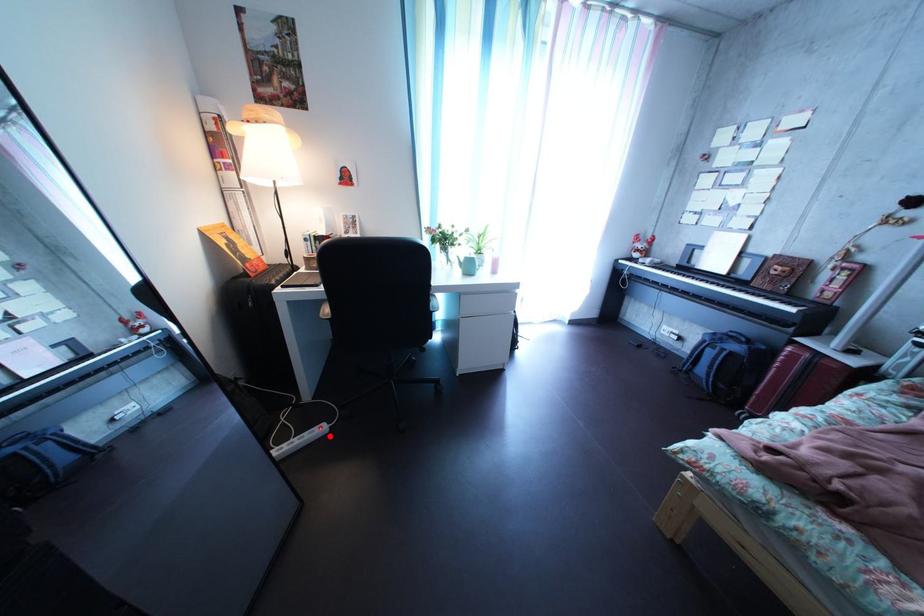
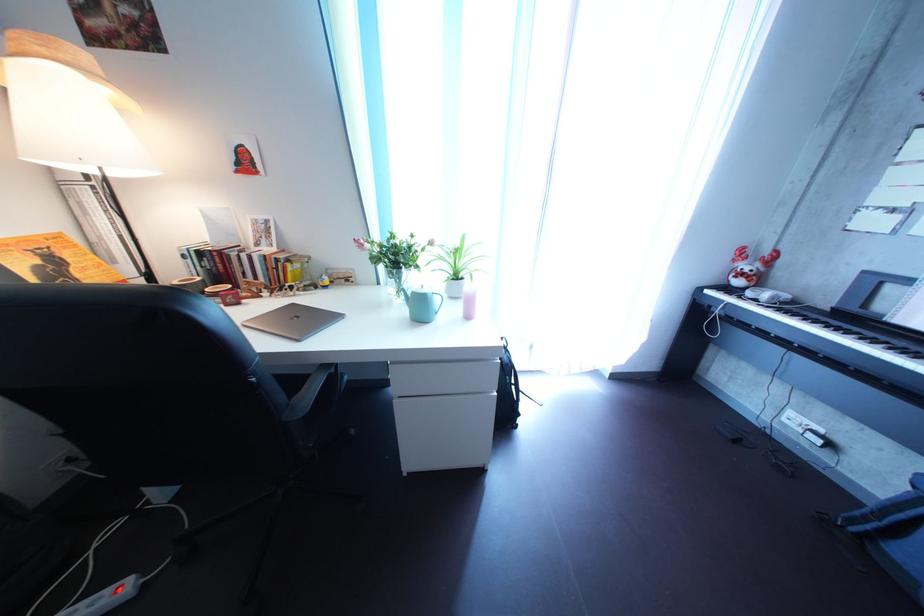
Locate, in the second image, the point that corresponds to the highlighted location in the first image.

(122, 601)